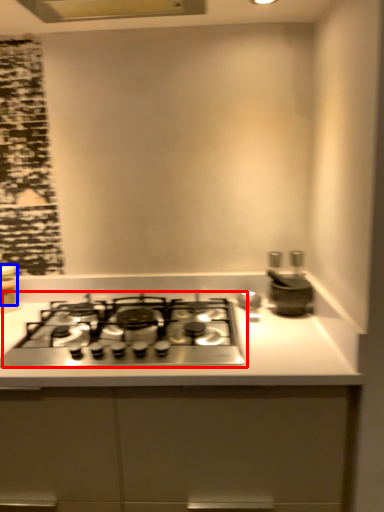
Question: Among these objects, which one is nearest to the camera, gas stove (highlighted by a red box) or kitchen appliance (highlighted by a blue box)?

Choices:
 (A) gas stove
 (B) kitchen appliance

Answer: (A)